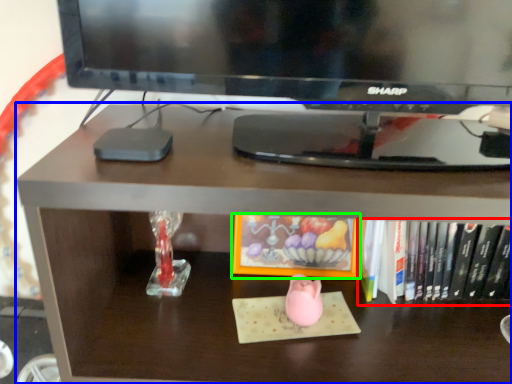
Question: Which is farther away from book (highlighted by a red box)? desk (highlighted by a blue box) or book (highlighted by a green box)?

Choices:
 (A) desk
 (B) book

Answer: (A)